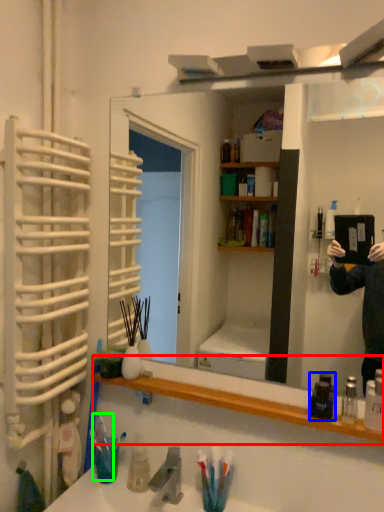
Question: Which is nearer to the bookshelf (highlighted by a red box)? mouthwash (highlighted by a blue box) or toothbrush (highlighted by a green box).

Choices:
 (A) mouthwash
 (B) toothbrush

Answer: (A)